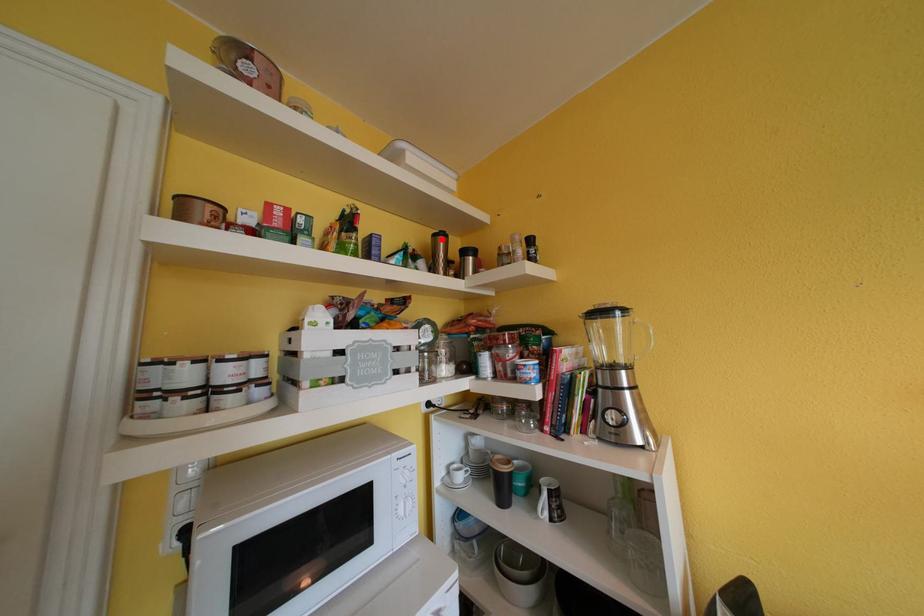
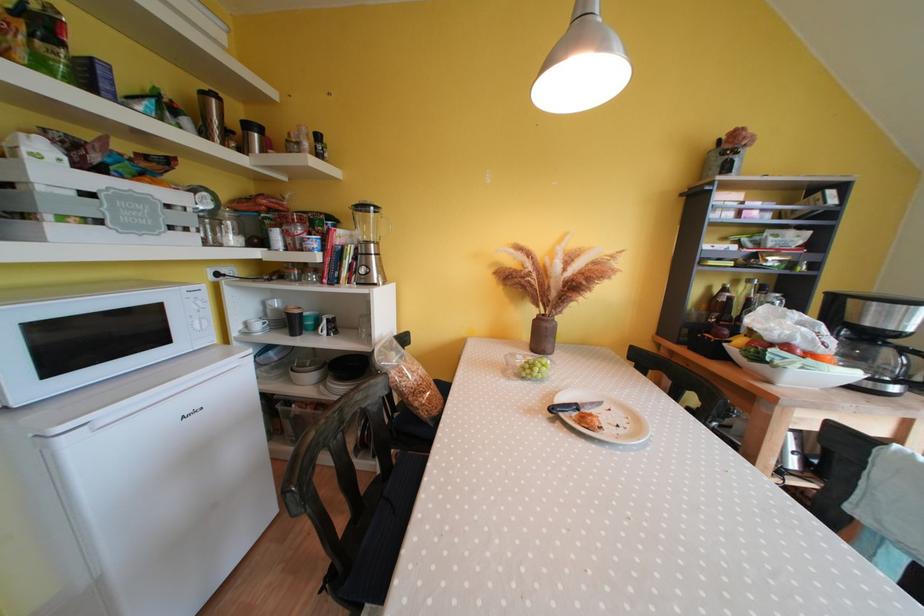
Locate, in the second image, the point that corresponds to the highlighted location in the first image.

(209, 98)